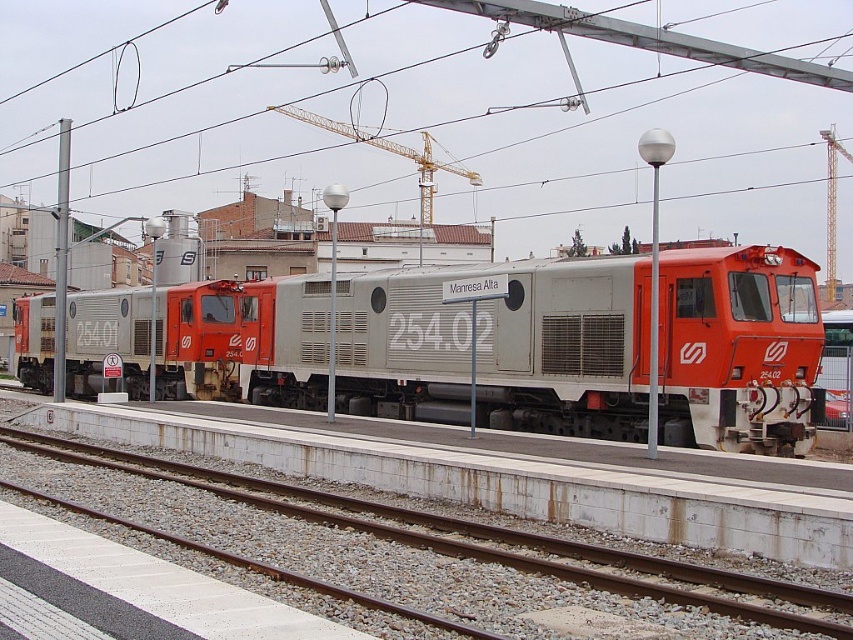
Question: Does metallic wire at upper center have a lesser width compared to gray gravel train track at center?

Choices:
 (A) yes
 (B) no

Answer: (B)

Question: Which object appears farthest from the camera in this image?

Choices:
 (A) gray gravel train track at center
 (B) matte gray train at center
 (C) metallic wire at upper center

Answer: (C)

Question: Which is nearer to the metallic wire at upper center?

Choices:
 (A) matte gray train at center
 (B) gray gravel train track at center

Answer: (A)

Question: Can you confirm if matte gray train at center is positioned to the left of metallic wire at upper center?

Choices:
 (A) yes
 (B) no

Answer: (A)

Question: Estimate the real-world distances between objects in this image. Which object is closer to the metallic wire at upper center?

Choices:
 (A) gray gravel train track at center
 (B) matte gray train at center

Answer: (B)

Question: In this image, where is matte gray train at center located relative to metallic wire at upper center?

Choices:
 (A) below
 (B) above

Answer: (A)